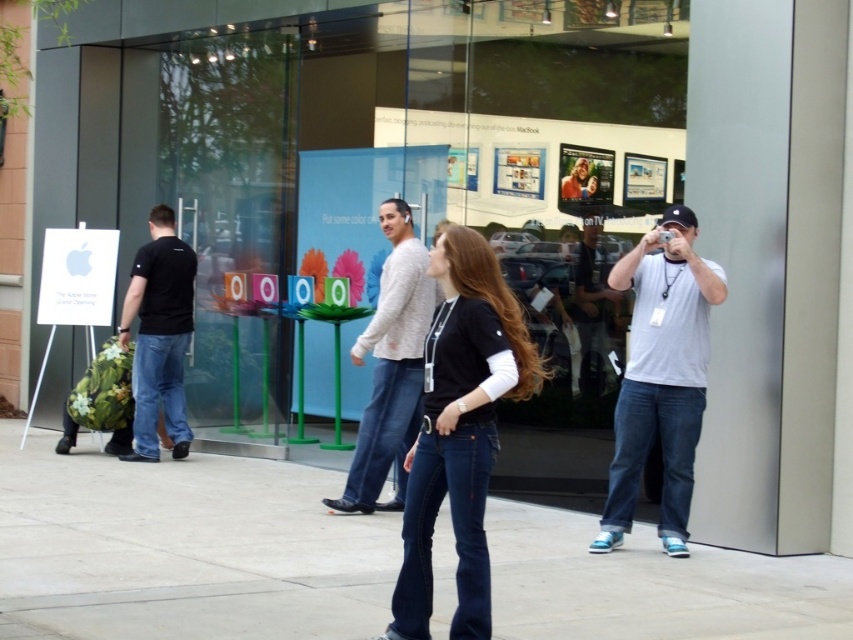
Question: Among these objects, which one is nearest to the camera?

Choices:
 (A) denim jeans at center
 (B) smooth concrete pavement at center
 (C) white cotton t-shirt at right

Answer: (A)

Question: Does smooth concrete pavement at center have a greater width compared to white cotton t-shirt at right?

Choices:
 (A) no
 (B) yes

Answer: (B)

Question: Considering the relative positions of denim jeans at center and black matte t-shirt at left in the image provided, where is denim jeans at center located with respect to black matte t-shirt at left?

Choices:
 (A) below
 (B) above

Answer: (A)

Question: Does denim jeans at center have a lesser width compared to black matte t-shirt at left?

Choices:
 (A) no
 (B) yes

Answer: (A)

Question: Which point is closer to the camera?

Choices:
 (A) (612, 280)
 (B) (149, 220)

Answer: (A)

Question: Which point is farther to the camera?

Choices:
 (A) (152, 234)
 (B) (370, 451)
 (C) (671, 337)
 (D) (437, 307)

Answer: (A)